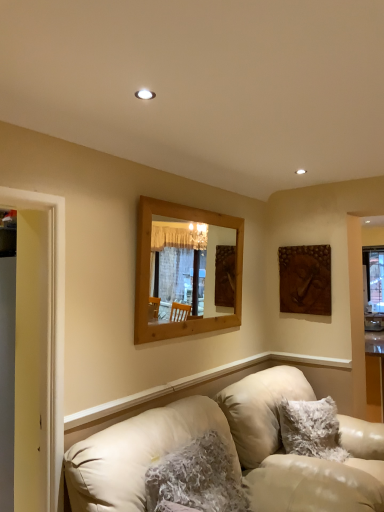
Question: From the image's perspective, is wooden mirror at center located above or below fuzzy white pillow at lower center, marked as the first pillow in a left-to-right arrangement?

Choices:
 (A) below
 (B) above

Answer: (B)

Question: Is point (173, 234) positioned closer to the camera than point (147, 495)?

Choices:
 (A) closer
 (B) farther

Answer: (B)

Question: Estimate the real-world distances between objects in this image. Which object is closer to the brown textured wall art at upper right?

Choices:
 (A) yellow wood door frame at left
 (B) leather couch at lower left
 (C) wooden mirror at center
 (D) fuzzy white pillow at lower center, which appears as the 1th pillow when viewed from the front
 (E) fuzzy white pillow at lower right, placed as the second pillow when sorted from front to back

Answer: (C)

Question: Based on their relative distances, which object is farther from the brown textured wall art at upper right?

Choices:
 (A) yellow wood door frame at left
 (B) fuzzy white pillow at lower center, which appears as the 1th pillow when viewed from the front
 (C) fuzzy white pillow at lower right, which is counted as the 1th pillow, starting from the right
 (D) wooden mirror at center
 (E) leather couch at lower left

Answer: (A)